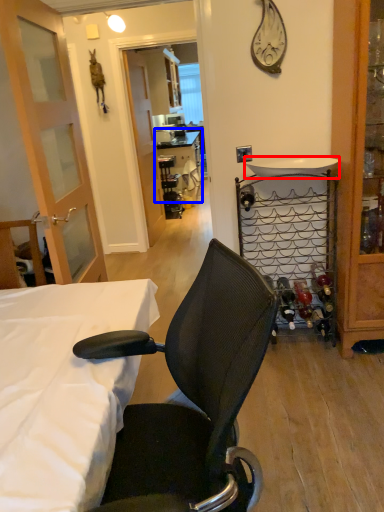
Question: Among these objects, which one is nearest to the camera, sink (highlighted by a red box) or table (highlighted by a blue box)?

Choices:
 (A) sink
 (B) table

Answer: (A)